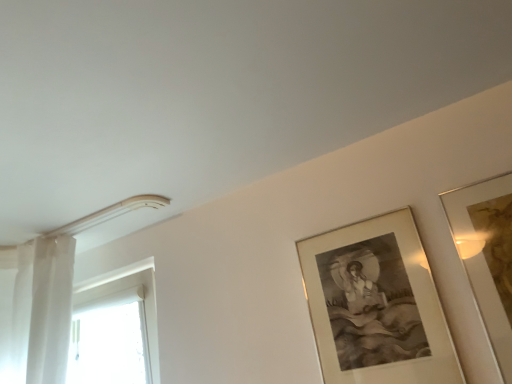
Find the location of `gold metallic picture frame at upper right, marked as the 1th picture frame in a right-to-left arrangement`. gold metallic picture frame at upper right, marked as the 1th picture frame in a right-to-left arrangement is located at coordinates (487, 255).

The width and height of the screenshot is (512, 384). I want to click on white glossy door at left, so click(x=115, y=333).

The height and width of the screenshot is (384, 512). Identify the location of gold-framed artwork at upper right, the 1th picture frame viewed from the left. (376, 305).

Is white glossy door at left positioned far away from gold metallic picture frame at upper right, marked as the 1th picture frame in a right-to-left arrangement?

Indeed, white glossy door at left is not near gold metallic picture frame at upper right, marked as the 1th picture frame in a right-to-left arrangement.

Can you tell me how much white glossy door at left and gold metallic picture frame at upper right, which appears as the 2th picture frame when viewed from the left, differ in facing direction?

The angular difference between white glossy door at left and gold metallic picture frame at upper right, which appears as the 2th picture frame when viewed from the left, is 0.000393 degrees.

From the image's perspective, between white glossy door at left and gold metallic picture frame at upper right, which appears as the 2th picture frame when viewed from the left, which one is located above?

gold metallic picture frame at upper right, which appears as the 2th picture frame when viewed from the left, is shown above in the image.

Which of these two, gold-framed artwork at upper right, the 1th picture frame viewed from the left, or gold metallic picture frame at upper right, which appears as the 2th picture frame when viewed from the left, is bigger?

With larger size is gold-framed artwork at upper right, the 1th picture frame viewed from the left.

The image size is (512, 384). In order to click on picture frame in front of the gold-framed artwork at upper right, arranged as the 2th picture frame when viewed from the right in this screenshot , I will do `click(487, 255)`.

From a real-world perspective, is gold-framed artwork at upper right, the 1th picture frame viewed from the left, physically located above or below gold metallic picture frame at upper right, which appears as the 2th picture frame when viewed from the left?

From a real-world perspective, gold-framed artwork at upper right, the 1th picture frame viewed from the left, is physically above gold metallic picture frame at upper right, which appears as the 2th picture frame when viewed from the left.

How different are the orientations of gold metallic picture frame at upper right, marked as the 1th picture frame in a right-to-left arrangement, and gold-framed artwork at upper right, the 1th picture frame viewed from the left, in degrees?

0.00113 degrees.

Between point (487, 205) and point (421, 345), which one is positioned in front?

The point (421, 345) is closer.

Is gold metallic picture frame at upper right, which appears as the 2th picture frame when viewed from the left, looking in the opposite direction of gold-framed artwork at upper right, arranged as the 2th picture frame when viewed from the right?

gold metallic picture frame at upper right, which appears as the 2th picture frame when viewed from the left, does not have its back to gold-framed artwork at upper right, arranged as the 2th picture frame when viewed from the right.

Does gold metallic picture frame at upper right, which appears as the 2th picture frame when viewed from the left, have a smaller size compared to gold-framed artwork at upper right, the 1th picture frame viewed from the left?

Indeed, gold metallic picture frame at upper right, which appears as the 2th picture frame when viewed from the left, has a smaller size compared to gold-framed artwork at upper right, the 1th picture frame viewed from the left.

From the image's perspective, which picture frame is the 2nd one above the white glossy door at left? Please provide its 2D coordinates.

[(487, 255)]

Considering the relative positions of gold metallic picture frame at upper right, which appears as the 2th picture frame when viewed from the left, and white glossy door at left in the image provided, is gold metallic picture frame at upper right, which appears as the 2th picture frame when viewed from the left, to the left of white glossy door at left from the viewer's perspective?

No, gold metallic picture frame at upper right, which appears as the 2th picture frame when viewed from the left, is not to the left of white glossy door at left.

From a real-world perspective, who is located lower, gold metallic picture frame at upper right, marked as the 1th picture frame in a right-to-left arrangement, or white glossy door at left?

In real-world perspective, gold metallic picture frame at upper right, marked as the 1th picture frame in a right-to-left arrangement, is lower.

Is point (472, 256) closer or farther from the camera than point (130, 315)?

Clearly, point (472, 256) is closer to the camera than point (130, 315).

Is white glossy door at left smaller than gold-framed artwork at upper right, the 1th picture frame viewed from the left?

No.

From the image's perspective, between white glossy door at left and gold-framed artwork at upper right, arranged as the 2th picture frame when viewed from the right, who is located below?

white glossy door at left appears lower in the image.

Considering the relative positions of white glossy door at left and gold-framed artwork at upper right, arranged as the 2th picture frame when viewed from the right, in the image provided, is white glossy door at left behind gold-framed artwork at upper right, arranged as the 2th picture frame when viewed from the right,?

Yes, white glossy door at left is further from the camera.

Is white glossy door at left positioned far away from gold-framed artwork at upper right, the 1th picture frame viewed from the left?

Yes.

Does gold-framed artwork at upper right, the 1th picture frame viewed from the left, touch white glossy door at left?

They are not placed beside each other.

From the image's perspective, which one is positioned higher, gold-framed artwork at upper right, the 1th picture frame viewed from the left, or white glossy door at left?

gold-framed artwork at upper right, the 1th picture frame viewed from the left, is shown above in the image.

Is gold-framed artwork at upper right, arranged as the 2th picture frame when viewed from the right, thinner than white glossy door at left?

Yes.

Is gold-framed artwork at upper right, the 1th picture frame viewed from the left, shorter than white glossy door at left?

Yes.

The image size is (512, 384). I want to click on the 2nd picture frame to the right when counting from the white glossy door at left, so click(487, 255).

You are a GUI agent. You are given a task and a screenshot of the screen. Output one action in this format:
    pyautogui.click(x=<x>, y=<y>)
    Task: Click on the picture frame that appears above the gold metallic picture frame at upper right, which appears as the 2th picture frame when viewed from the left (from a real-world perspective)
    
    Given the screenshot: What is the action you would take?
    pyautogui.click(x=376, y=305)

From the image, which object appears to be nearer to gold metallic picture frame at upper right, which appears as the 2th picture frame when viewed from the left, gold-framed artwork at upper right, the 1th picture frame viewed from the left, or white glossy door at left?

gold-framed artwork at upper right, the 1th picture frame viewed from the left, is closer to gold metallic picture frame at upper right, which appears as the 2th picture frame when viewed from the left.

When comparing their distances from gold metallic picture frame at upper right, marked as the 1th picture frame in a right-to-left arrangement, does white glossy door at left or gold-framed artwork at upper right, arranged as the 2th picture frame when viewed from the right, seem closer?

Based on the image, gold-framed artwork at upper right, arranged as the 2th picture frame when viewed from the right, appears to be nearer to gold metallic picture frame at upper right, marked as the 1th picture frame in a right-to-left arrangement.

From the image, which object appears to be farther from gold-framed artwork at upper right, arranged as the 2th picture frame when viewed from the right, gold metallic picture frame at upper right, marked as the 1th picture frame in a right-to-left arrangement, or white glossy door at left?

white glossy door at left is further to gold-framed artwork at upper right, arranged as the 2th picture frame when viewed from the right.

Considering their positions, is gold-framed artwork at upper right, arranged as the 2th picture frame when viewed from the right, positioned closer to white glossy door at left than gold metallic picture frame at upper right, which appears as the 2th picture frame when viewed from the left?

gold-framed artwork at upper right, arranged as the 2th picture frame when viewed from the right, is closer to white glossy door at left.

Which object lies nearer to the anchor point white glossy door at left, gold metallic picture frame at upper right, which appears as the 2th picture frame when viewed from the left, or gold-framed artwork at upper right, arranged as the 2th picture frame when viewed from the right?

gold-framed artwork at upper right, arranged as the 2th picture frame when viewed from the right, is positioned closer to the anchor white glossy door at left.

Looking at the image, which one is located closer to gold-framed artwork at upper right, the 1th picture frame viewed from the left, white glossy door at left or gold metallic picture frame at upper right, marked as the 1th picture frame in a right-to-left arrangement?

gold metallic picture frame at upper right, marked as the 1th picture frame in a right-to-left arrangement, is positioned closer to the anchor gold-framed artwork at upper right, the 1th picture frame viewed from the left.

The image size is (512, 384). In order to click on picture frame located between white glossy door at left and gold metallic picture frame at upper right, which appears as the 2th picture frame when viewed from the left, in the left-right direction in this screenshot , I will do `click(376, 305)`.